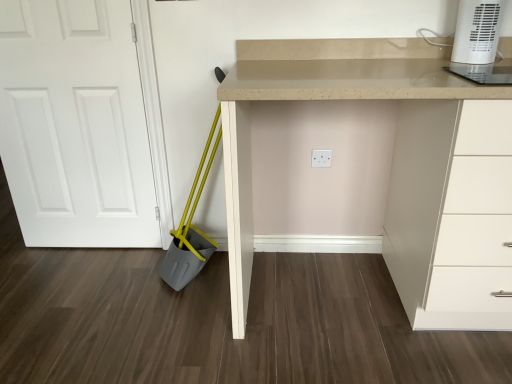
The image size is (512, 384). I want to click on vacant position to the left of beige laminate desk at center, so click(152, 324).